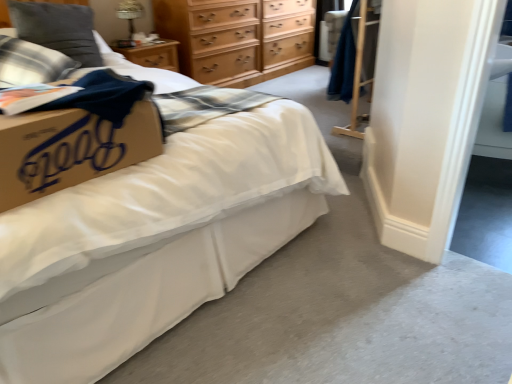
Question: Is point (30, 44) closer or farther from the camera than point (69, 23)?

Choices:
 (A) farther
 (B) closer

Answer: (B)

Question: Is plaid fabric pillow at upper left, which appears as the first pillow when ordered from the bottom, taller or shorter than plush gray pillow at upper left, which ranks as the 1th pillow in top-to-bottom order?

Choices:
 (A) tall
 (B) short

Answer: (B)

Question: Estimate the real-world distances between objects in this image. Which object is closer to the white matte bed at center?

Choices:
 (A) light brown wooden chest of drawers at upper center
 (B) plush gray pillow at upper left, which ranks as the 1th pillow in top-to-bottom order
 (C) plaid fabric pillow at upper left, acting as the second pillow starting from the top

Answer: (C)

Question: Which of these objects is positioned farthest from the white matte bed at center?

Choices:
 (A) light brown wooden chest of drawers at upper center
 (B) plaid fabric pillow at upper left, which appears as the first pillow when ordered from the bottom
 (C) plush gray pillow at upper left, which ranks as the 1th pillow in top-to-bottom order

Answer: (A)